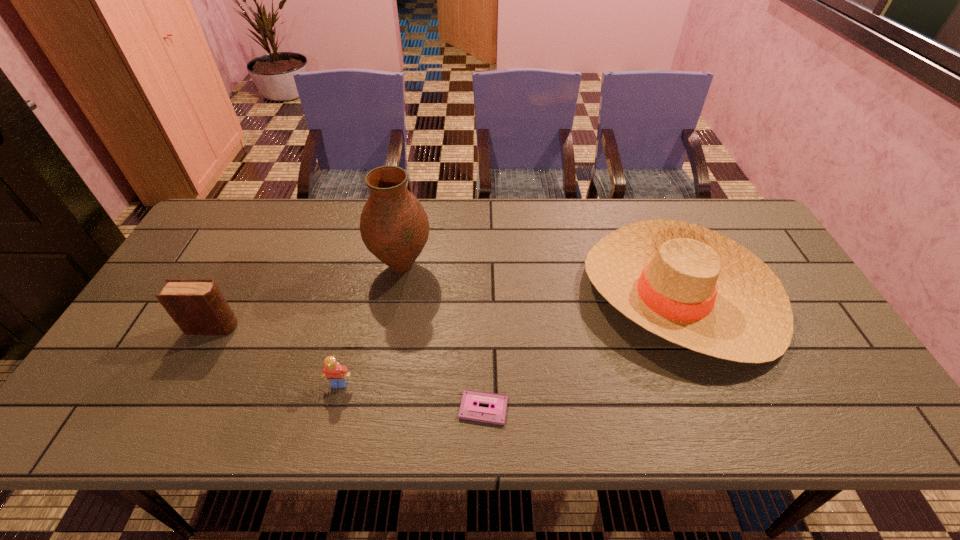
Where is `free spot at the left edge of the desktop`? The image size is (960, 540). free spot at the left edge of the desktop is located at coordinates (121, 387).

This screenshot has height=540, width=960. In the image, there is a desktop. Identify the location of vacant space at the right edge. (796, 299).

You are a GUI agent. You are given a task and a screenshot of the screen. Output one action in this format:
    pyautogui.click(x=<x>, y=<y>)
    Task: Click on the vacant space at the far left corner
    The image size is (960, 540).
    Given the screenshot: What is the action you would take?
    pos(229,234)

Locate an element on the screen. free space at the far right corner of the desktop is located at coordinates (725, 204).

At what (x,y) coordinates should I click in order to perform the action: click on empty location between the nearest object and the rightmost object. Please return your answer as a coordinate pair (x, y). Looking at the image, I should click on point(581,352).

The image size is (960, 540). I want to click on unoccupied position between the leftmost object and the sunhat, so click(x=445, y=311).

You are a GUI agent. You are given a task and a screenshot of the screen. Output one action in this format:
    pyautogui.click(x=<x>, y=<y>)
    Task: Click on the free space between the shortest object and the diary
    This screenshot has width=960, height=540.
    Given the screenshot: What is the action you would take?
    pyautogui.click(x=348, y=368)

Identify the location of free space between the diary and the videotape. (348, 368).

Where is `free spot between the leftmost object and the shortest object`? Image resolution: width=960 pixels, height=540 pixels. free spot between the leftmost object and the shortest object is located at coordinates 348,368.

Find the location of `empty space between the rightmost object and the second nearest object`. empty space between the rightmost object and the second nearest object is located at coordinates (509, 340).